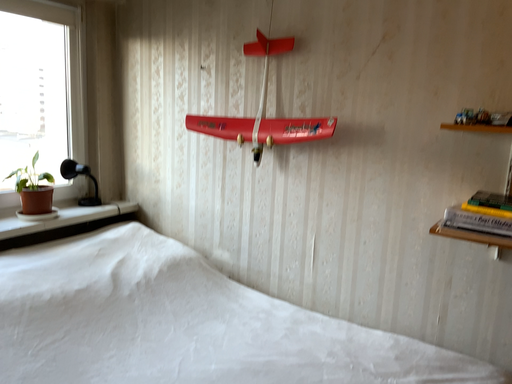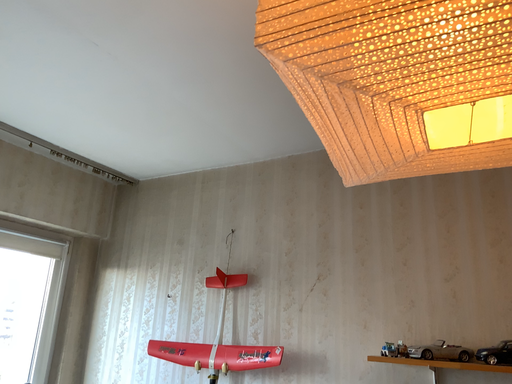
Question: Which way did the camera rotate in the video?

Choices:
 (A) rotated downward
 (B) rotated upward

Answer: (B)